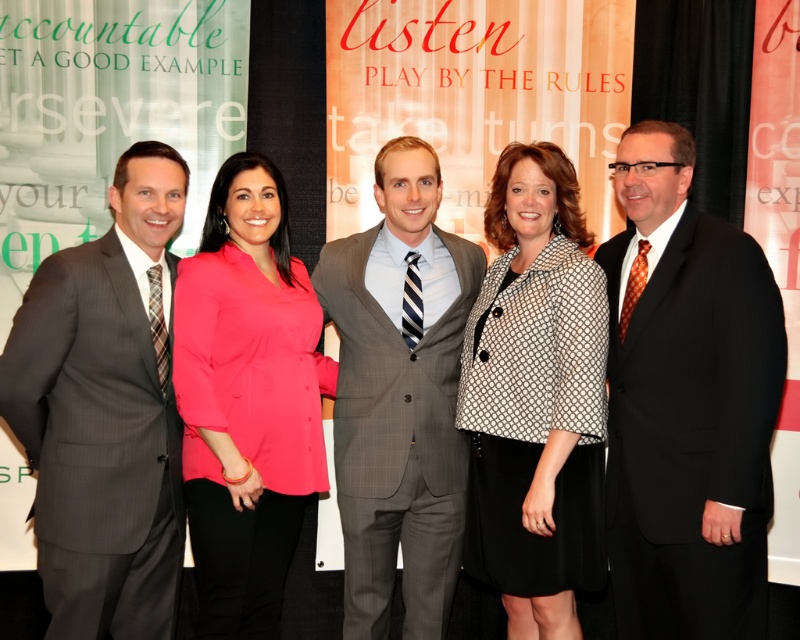
You are organizing a photo shoot and need to arrange two key participants based on their clothing. The participants are wearing the black pinstripe suit at right and the black textured blazer at center. Which participant should stand in the front to ensure both are visible in the photo?

The black textured blazer at center should stand in front because the black pinstripe suit at right is taller than it, so placing the shorter one in front would allow both to be visible.

You are a photographer trying to adjust the lighting for the group photo. You notice that the person wearing a black pinstripe suit at right is standing at coordinate point (686,403). Which individual in the group does this coordinate correspond to?

The coordinate point (686,403) corresponds to the black pinstripe suit at right, which is the fifth man in the group from left to right.

You are organizing a photo shoot for a fashion magazine. You have two key outfits to feature in the layout design. The first is the gray pinstripe suit at left and the second is the pink satin blouse at center. Given that the magazine requires the wider garment to be placed in the central position to draw more attention, which garment should you place in the center?

The pink satin blouse at center is wider than the gray pinstripe suit at left, so the pink satin blouse at center should be placed in the central position to draw more attention.